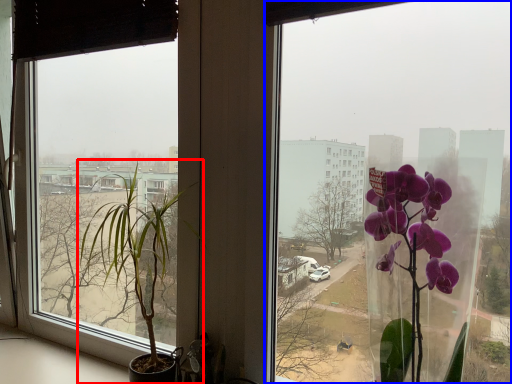
Question: Which point is further to the camera, houseplant (highlighted by a red box) or window (highlighted by a blue box)?

Choices:
 (A) houseplant
 (B) window

Answer: (A)